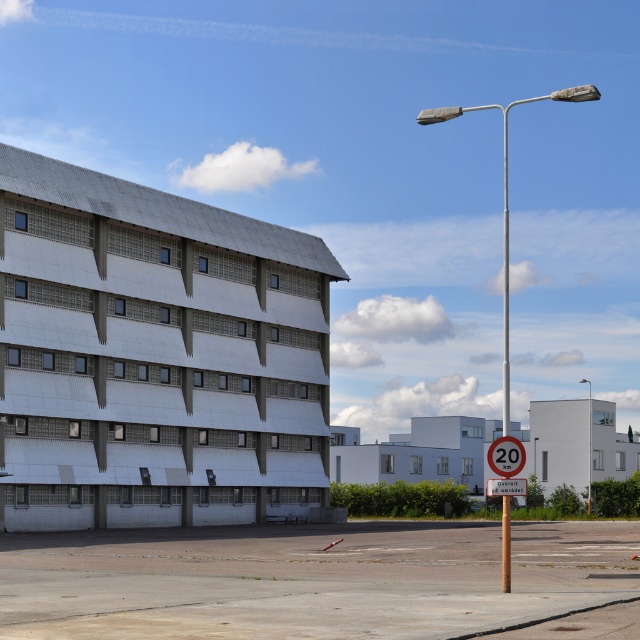
Can you confirm if white plastic sign at upper center is bigger than metallic pole at upper right?

No, white plastic sign at upper center is not bigger than metallic pole at upper right.

Does point (522, 477) come farther from viewer compared to point (589, 496)?

No, (522, 477) is in front of (589, 496).

This screenshot has width=640, height=640. I want to click on white plastic sign at upper center, so click(506, 486).

Does point (508, 358) lie in front of point (518, 492)?

No, it is behind (518, 492).

Is metallic pole at right bigger than white plastic sign at upper center?

Yes, metallic pole at right is bigger than white plastic sign at upper center.

The width and height of the screenshot is (640, 640). I want to click on metallic pole at right, so click(506, 280).

Is metallic gray pole at right smaller than red plastic speed limit sign at center?

Incorrect, metallic gray pole at right is not smaller in size than red plastic speed limit sign at center.

Which is more to the left, metallic gray pole at right or red plastic speed limit sign at center?

Positioned to the left is red plastic speed limit sign at center.

Is point (504, 516) closer to camera compared to point (492, 464)?

No, it is behind (492, 464).

Identify the location of metallic gray pole at right. (506, 196).